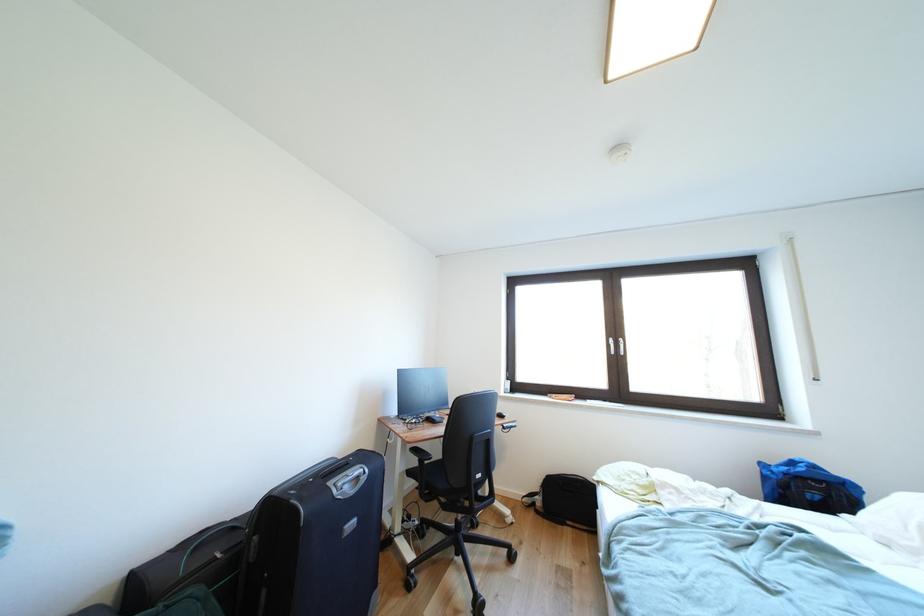
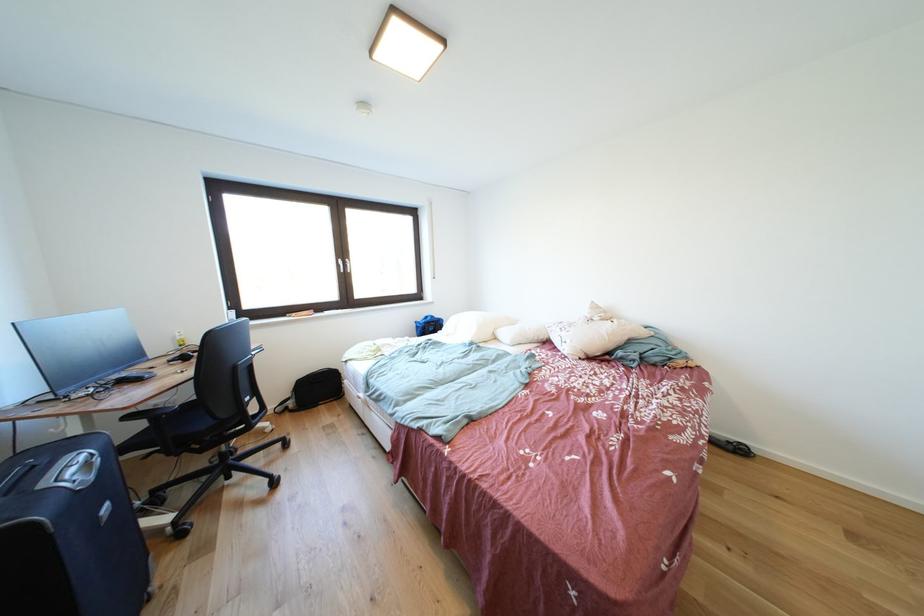
Find the pixel in the second image that matches (844,477) in the first image.

(445, 321)